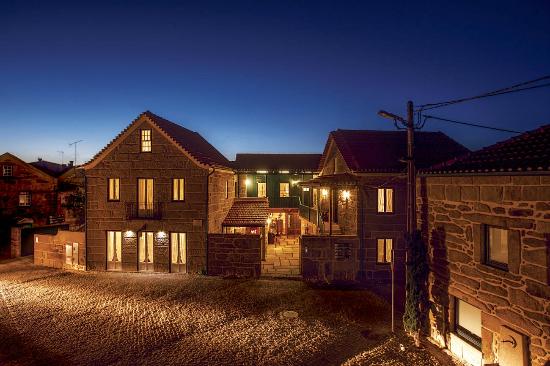
Locate an element on the screen. This screenshot has height=366, width=550. third floor window is located at coordinates (142, 146), (5, 172).